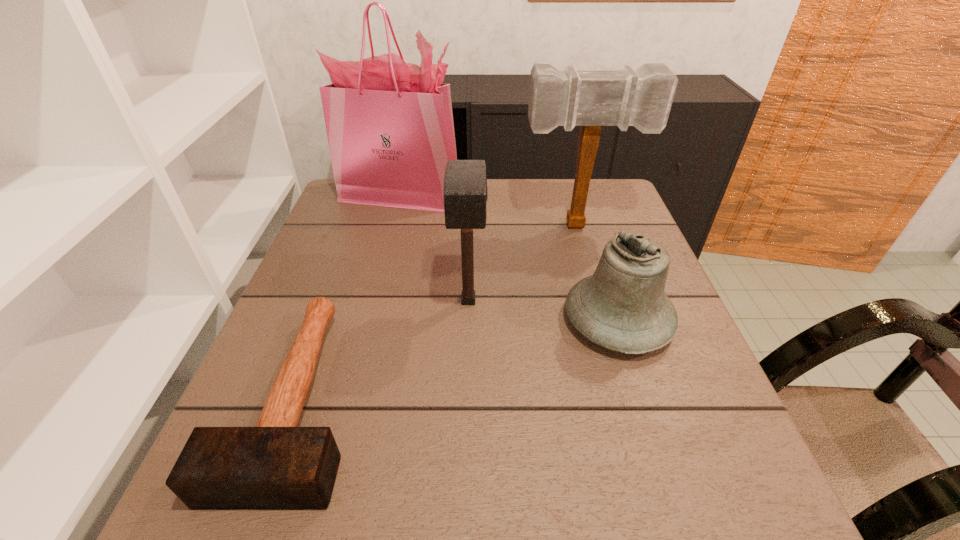
Where is `shopping bag`? shopping bag is located at coordinates (390, 129).

This screenshot has height=540, width=960. Find the location of `the tallest object`. the tallest object is located at coordinates point(390,129).

Locate an element on the screen. the rightmost mallet is located at coordinates (642, 98).

Locate an element on the screen. Image resolution: width=960 pixels, height=540 pixels. the fourth nearest object is located at coordinates (642, 98).

Find the location of a particular element. the second tallest mallet is located at coordinates (465, 192).

Identify the location of the second mallet from left to right. This screenshot has width=960, height=540. (465, 192).

The image size is (960, 540). I want to click on bell, so click(622, 307).

Locate an element on the screen. The width and height of the screenshot is (960, 540). the shortest mallet is located at coordinates (275, 465).

This screenshot has height=540, width=960. In order to click on the leftmost mallet in this screenshot , I will do pos(275,465).

Where is `vacant region located 0.060m on the right of the farthest object`? This screenshot has height=540, width=960. vacant region located 0.060m on the right of the farthest object is located at coordinates (479, 195).